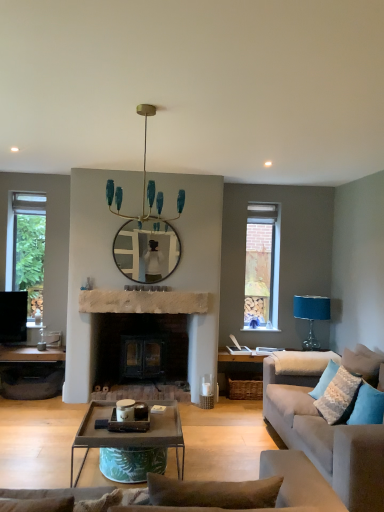
Identify the location of blank space situated above teal glass chandelier at upper center (from a real-world perspective). (146, 105).